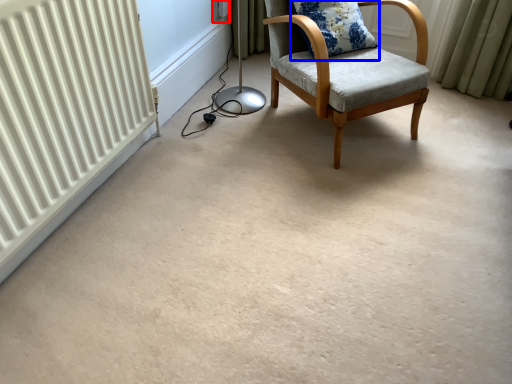
Question: Which object is closer to the camera taking this photo, electric outlet (highlighted by a red box) or pillow (highlighted by a blue box)?

Choices:
 (A) electric outlet
 (B) pillow

Answer: (B)